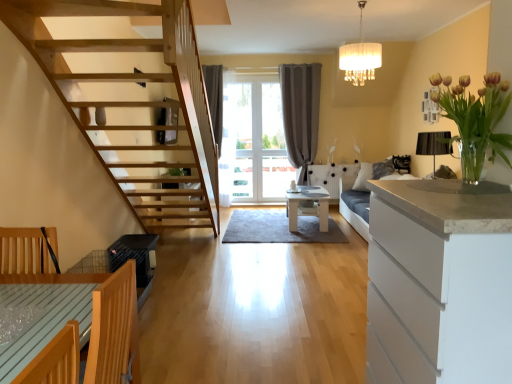
Question: Which direction should I rotate to face white glossy table at center, marked as the 2th table in a bottom-to-top arrangement, — up or down?

Choices:
 (A) up
 (B) down

Answer: (B)

Question: Is translucent glass vase at upper right bigger than white fabric lampshade at upper center?

Choices:
 (A) no
 (B) yes

Answer: (A)

Question: From a real-world perspective, is translucent glass vase at upper right on white fabric lampshade at upper center?

Choices:
 (A) no
 (B) yes

Answer: (A)

Question: From the image's perspective, is translucent glass vase at upper right under white fabric lampshade at upper center?

Choices:
 (A) yes
 (B) no

Answer: (A)

Question: Does translucent glass vase at upper right appear on the right side of white fabric lampshade at upper center?

Choices:
 (A) no
 (B) yes

Answer: (A)

Question: Is translucent glass vase at upper right taller than white fabric lampshade at upper center?

Choices:
 (A) yes
 (B) no

Answer: (B)

Question: Is translucent glass vase at upper right aimed at white fabric lampshade at upper center?

Choices:
 (A) yes
 (B) no

Answer: (B)

Question: Is white fabric lampshade at upper center surrounded by white glossy table at center, marked as the 2th table in a bottom-to-top arrangement?

Choices:
 (A) no
 (B) yes

Answer: (A)

Question: Is white fabric lampshade at upper center at the back of white glossy table at center, which ranks as the second table in front-to-back order?

Choices:
 (A) yes
 (B) no

Answer: (B)

Question: Considering the relative positions of white glossy table at center, which ranks as the second table in front-to-back order, and white fabric lampshade at upper center in the image provided, is white glossy table at center, which ranks as the second table in front-to-back order, to the left of white fabric lampshade at upper center from the viewer's perspective?

Choices:
 (A) no
 (B) yes

Answer: (B)

Question: From a real-world perspective, is white glossy table at center, which is the 1th table in top-to-bottom order, on white fabric lampshade at upper center?

Choices:
 (A) no
 (B) yes

Answer: (A)

Question: From the image's perspective, would you say white glossy table at center, which is the 1th table in top-to-bottom order, is shown under white fabric lampshade at upper center?

Choices:
 (A) no
 (B) yes

Answer: (B)

Question: Is white glossy table at center, the 1th table in the back-to-front sequence, positioned in front of white fabric lampshade at upper center?

Choices:
 (A) yes
 (B) no

Answer: (B)

Question: Considering the relative sizes of white fabric lampshade at upper center and white matte cabinet at right in the image provided, is white fabric lampshade at upper center taller than white matte cabinet at right?

Choices:
 (A) yes
 (B) no

Answer: (B)